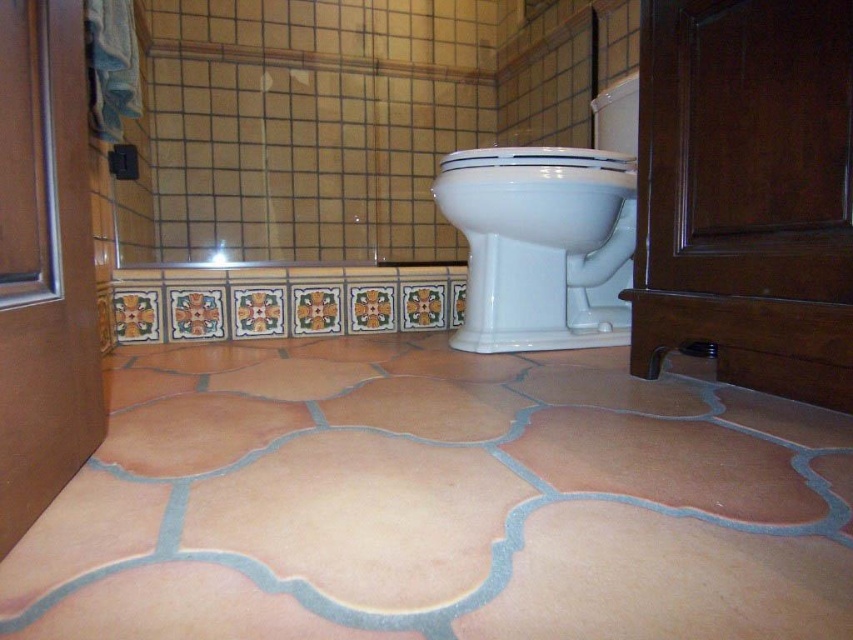
You are standing in the bathroom and want to clean the terracotta textured tile at center and the white glossy toilet bowl at center. Which object is closer to you?

The terracotta textured tile at center is closer to you because it is in front of the white glossy toilet bowl at center.

You are standing in the bathroom and want to place a small potted plant exactly at the point marked as point (437, 502). According to the scene description, what type of flooring material will the plant be placed on?

The point (437, 502) is on terracotta textured tile at center, so the plant will be placed on terracotta textured tile at center.

You are standing in the bathroom and want to clean the white glossy toilet bowl at center. To reach it, you need to step over the terracotta textured tile at center. Is the toilet bowl above or below the tile?

The terracotta textured tile at center is below the white glossy toilet bowl at center, so the toilet bowl is above the tile.